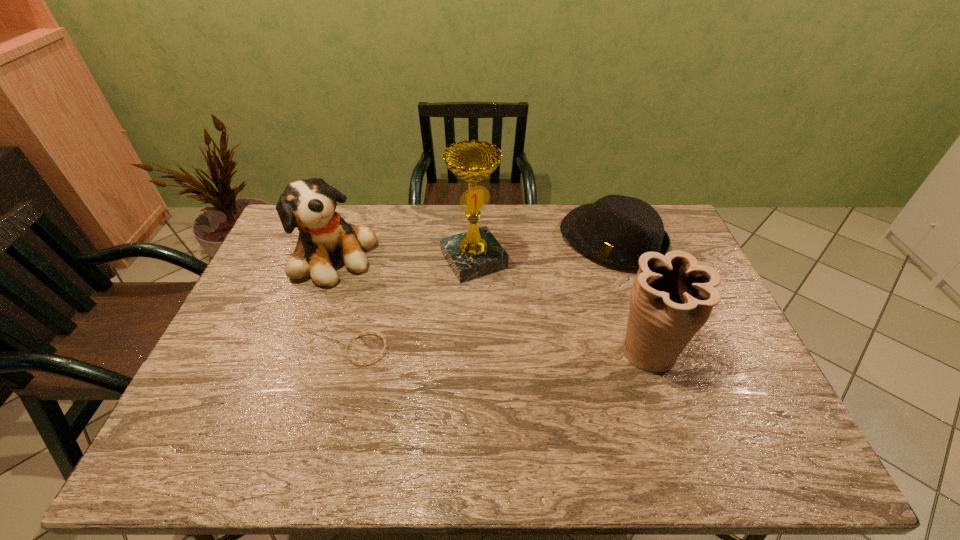
This screenshot has width=960, height=540. I want to click on free spot on the desktop that is between the shortest object and the urn and is positioned on the front-facing side of the award, so click(535, 350).

The width and height of the screenshot is (960, 540). Identify the location of vacant space on the desktop that is between the shortest object and the urn and is positioned on the front-facing side of the fedora. (502, 350).

You are a GUI agent. You are given a task and a screenshot of the screen. Output one action in this format:
    pyautogui.click(x=<x>, y=<y>)
    Task: Click on the free space on the desktop that is between the bracelet and the urn and is positioned at the face of the puppy
    This screenshot has height=540, width=960.
    Given the screenshot: What is the action you would take?
    pyautogui.click(x=472, y=350)